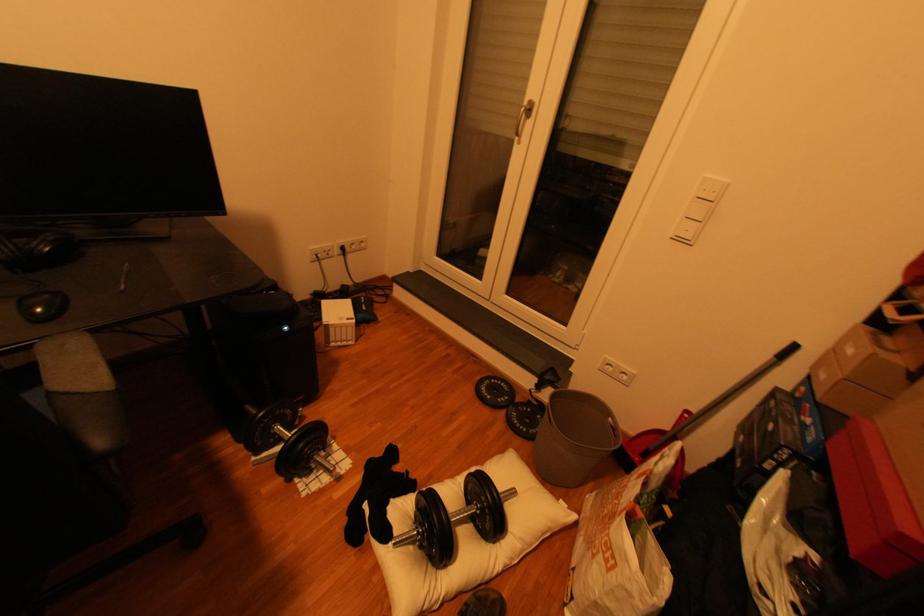
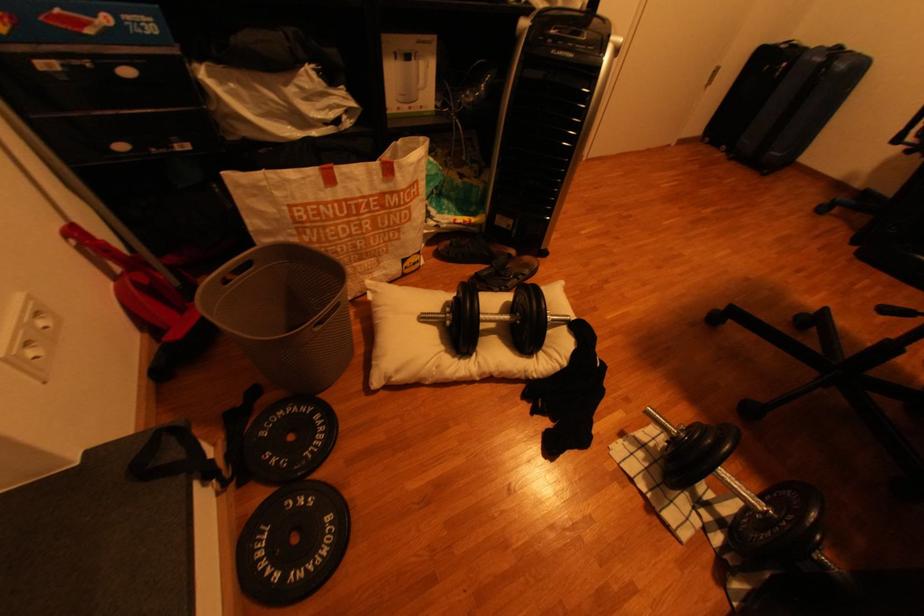
The point at (535, 430) is marked in the first image. Where is the corresponding point in the second image?

(325, 419)